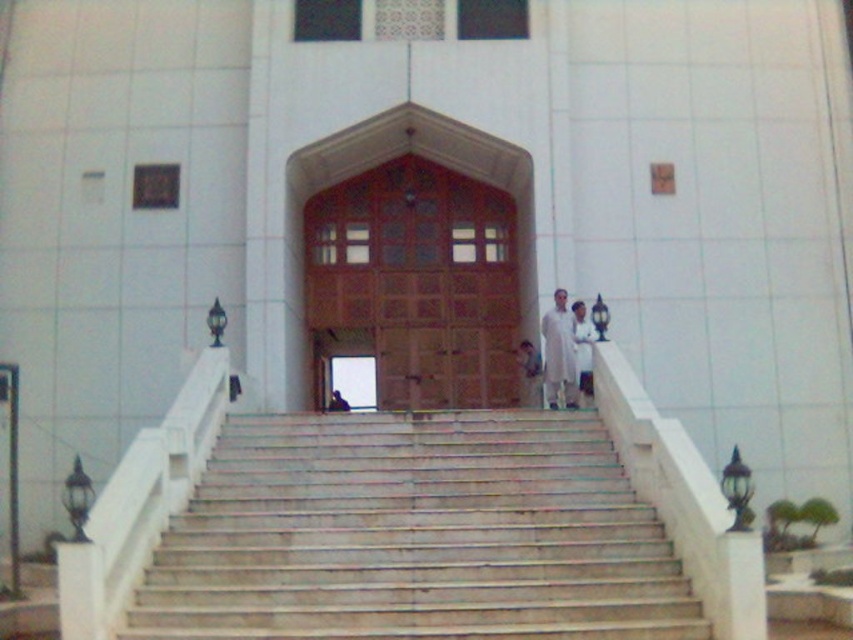
Between white marble stairs at center and white cloth at center, which one appears on the left side from the viewer's perspective?

white marble stairs at center is more to the left.

Image resolution: width=853 pixels, height=640 pixels. What do you see at coordinates (415, 534) in the screenshot?
I see `white marble stairs at center` at bounding box center [415, 534].

Locate an element on the screen. white marble stairs at center is located at coordinates (415, 534).

Who is positioned more to the left, white cloth at center or white fabric person at center?

white fabric person at center

Is white cloth at center thinner than white fabric person at center?

Incorrect, white cloth at center's width is not less than white fabric person at center's.

This screenshot has width=853, height=640. Identify the location of white cloth at center. tap(583, 348).

Is white marble stairs at center to the left of white fabric person at center from the viewer's perspective?

Yes, white marble stairs at center is to the left of white fabric person at center.

Describe the element at coordinates (415, 534) in the screenshot. I see `white marble stairs at center` at that location.

Identify the location of white marble stairs at center. (415, 534).